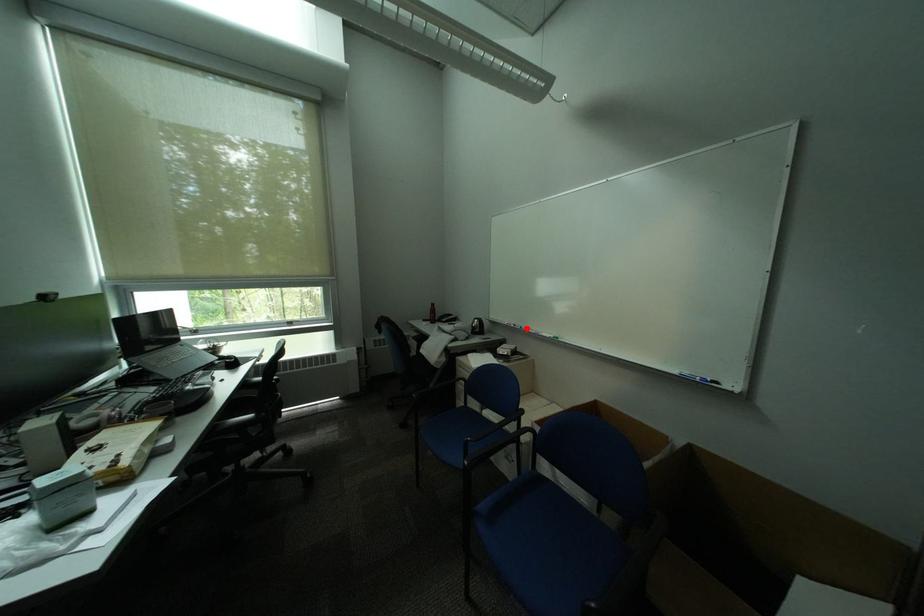
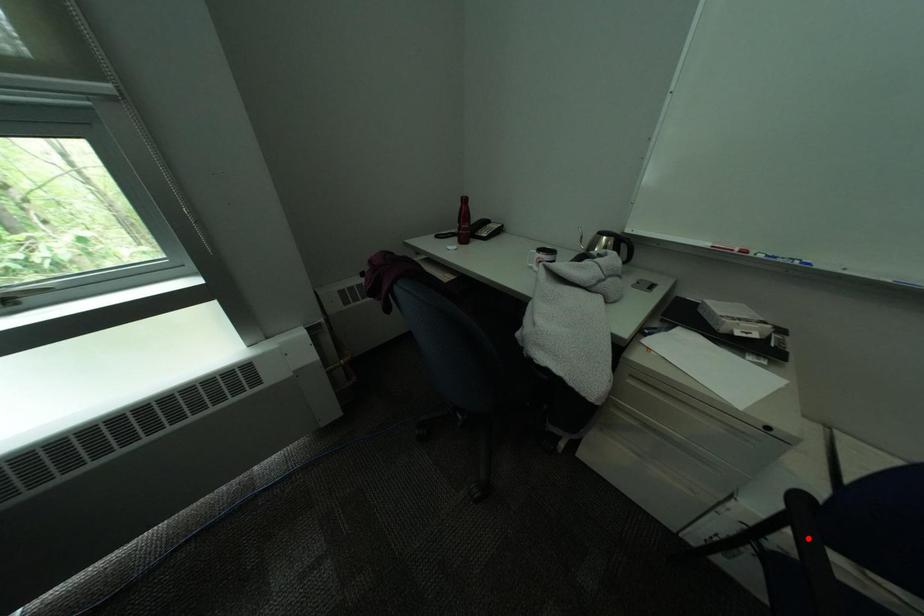
I am providing you with two images of the same scene from different viewpoints. A red point is marked on the first image and another point is marked on the second image. Do the highlighted points in image1 and image2 indicate the same real-world spot?

No